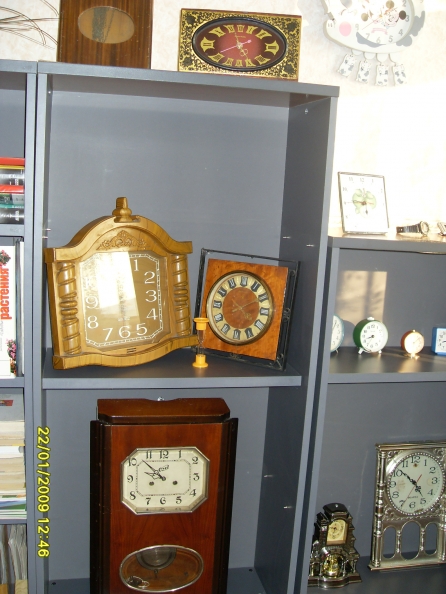
Find the location of `books on top shelf of left bookcase`. books on top shelf of left bookcase is located at coordinates (14, 162), (10, 168), (15, 179), (16, 189), (14, 202), (14, 214).